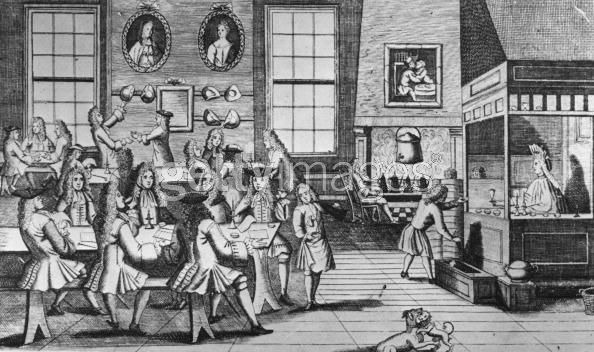
Identify the location of basket handle. The width and height of the screenshot is (594, 352). pos(579,289).